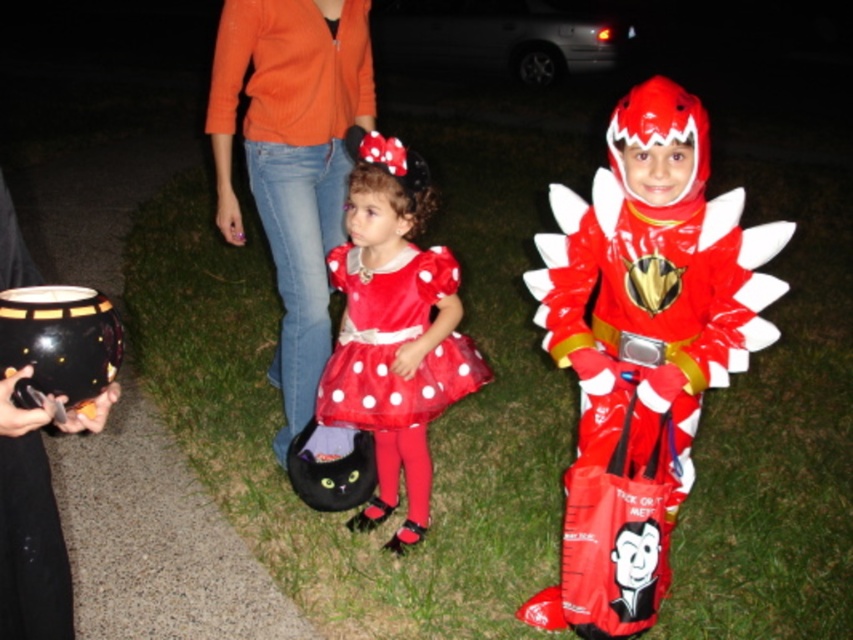
In the scene shown: What is the color of the object located at point (291, 160) in the image?

The object located at point (291, 160) is an orange cotton sweater at upper center.